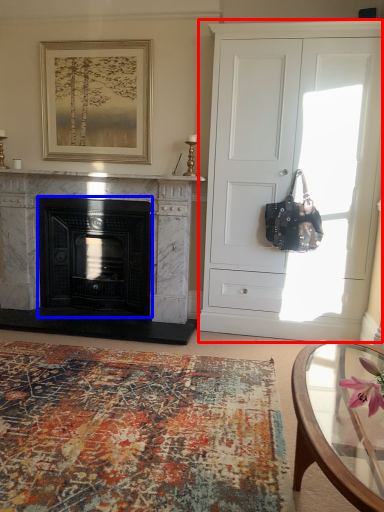
Question: Which object is closer to the camera taking this photo, cabinetry (highlighted by a red box) or fireplace (highlighted by a blue box)?

Choices:
 (A) cabinetry
 (B) fireplace

Answer: (A)